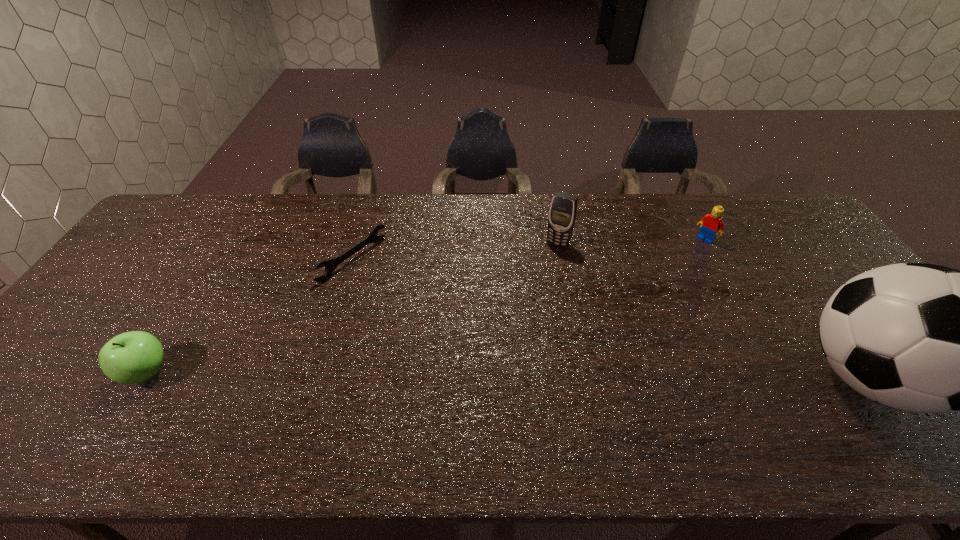
This screenshot has width=960, height=540. What are the coordinates of `free space on the desktop that is between the apple and the rightmost object and is positioned on the face of the Lego` in the screenshot? It's located at (564, 375).

Where is `vacant space on the desktop that is between the leftmost object and the tallest object and is positioned on the front face of the second tallest object`? The height and width of the screenshot is (540, 960). vacant space on the desktop that is between the leftmost object and the tallest object and is positioned on the front face of the second tallest object is located at coordinates (487, 375).

You are a GUI agent. You are given a task and a screenshot of the screen. Output one action in this format:
    pyautogui.click(x=<x>, y=<y>)
    Task: Click on the free space on the desktop that is between the apple and the tallest object and is positioned on the open ends of the shortest object
    
    Given the screenshot: What is the action you would take?
    pyautogui.click(x=539, y=375)